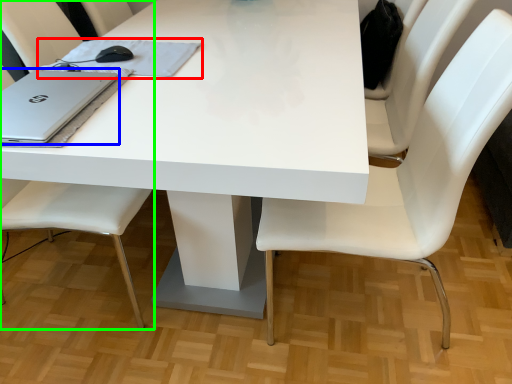
Question: Estimate the real-world distances between objects in this image. Which object is farther from notebook (highlighted by a red box), laptop (highlighted by a blue box) or chair (highlighted by a green box)?

Choices:
 (A) laptop
 (B) chair

Answer: (B)